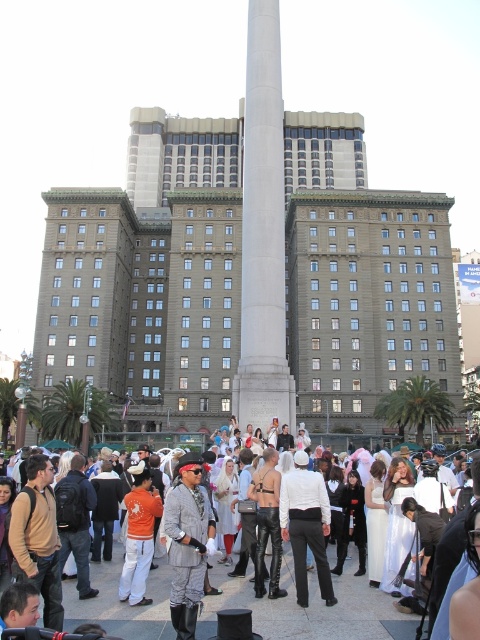
Between point (382, 611) and point (176, 614), which one is positioned in front?

Point (176, 614) is more forward.

Between silver metallic armor at center and gray fabric jacket at center, which one is positioned lower?

silver metallic armor at center is lower down.

Measure the distance between silver metallic armor at center and camera.

silver metallic armor at center is 115.19 feet from camera.

Identify the location of silver metallic armor at center. The image size is (480, 640). point(309,605).

Who is more forward, [267,172] or [194,458]?

Point [194,458] is in front.

Who is positioned more to the left, white marble column at center or gray fabric jacket at center?

From the viewer's perspective, gray fabric jacket at center appears more on the left side.

Image resolution: width=480 pixels, height=640 pixels. What are the coordinates of `white marble column at center` in the screenshot? It's located at (263, 234).

Which is above, gray stone building at center or silver metallic armor at center?

Positioned higher is gray stone building at center.

Image resolution: width=480 pixels, height=640 pixels. Identify the location of gray stone building at center. (149, 276).

I want to click on gray stone building at center, so click(x=149, y=276).